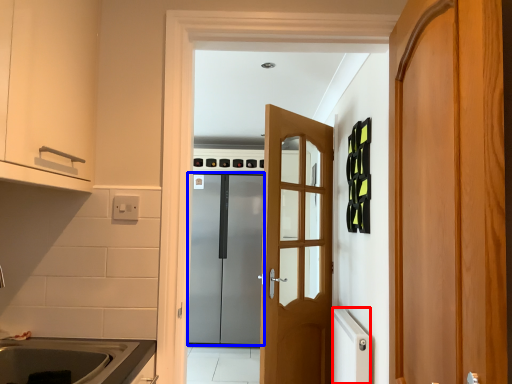
Question: Which object appears closest to the camera in this image, appliance (highlighted by a red box) or door (highlighted by a blue box)?

Choices:
 (A) appliance
 (B) door

Answer: (A)